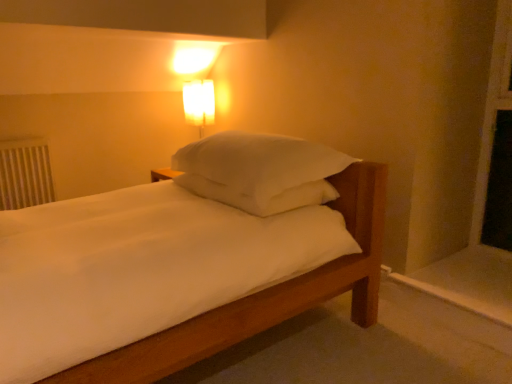
Identify the location of vacant region above wooden bed frame at lower center (from a real-world perspective). (343, 352).